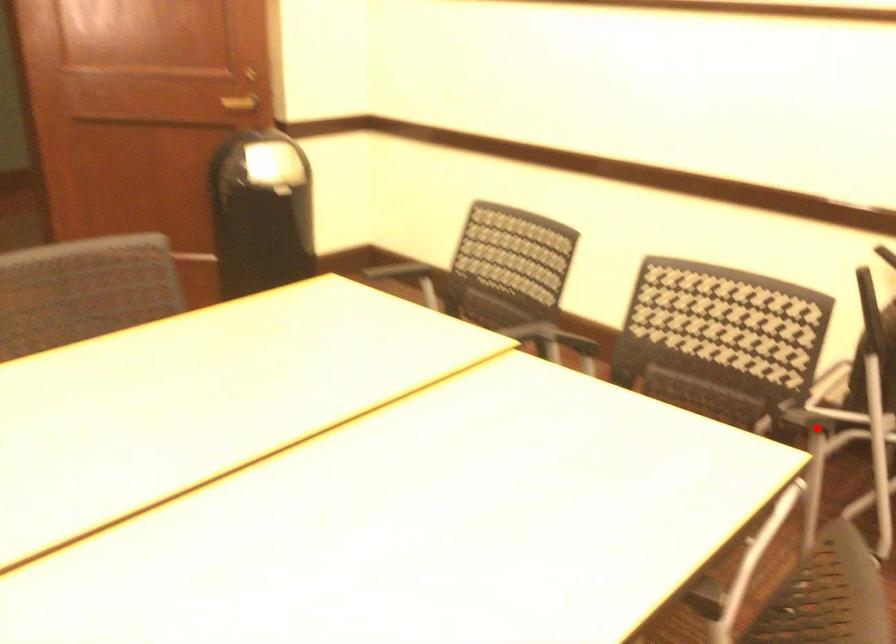
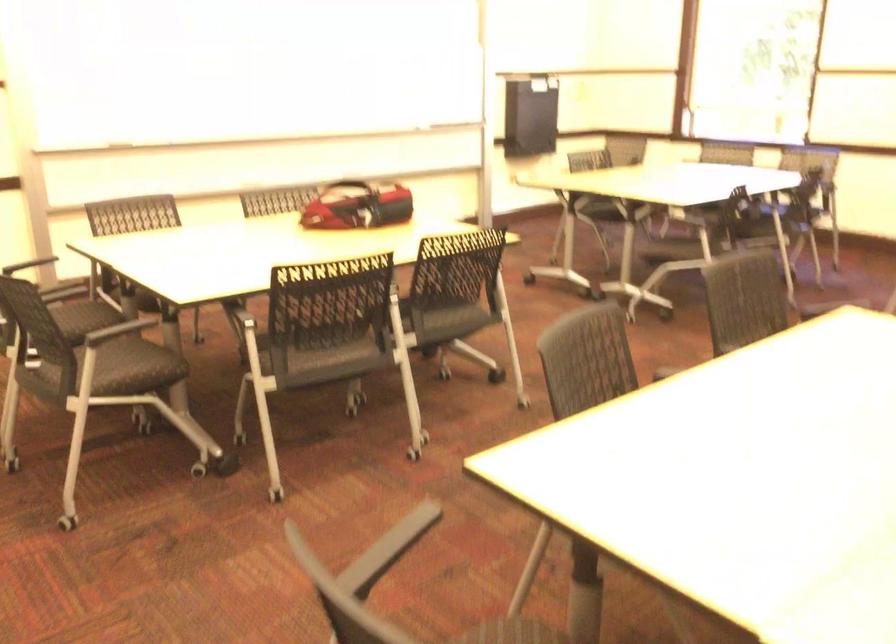
Question: I am providing you with two images of the same scene from different viewpoints. A red point is marked on the first image. Can you still see the location of the red point in image 2?

Choices:
 (A) Yes
 (B) No

Answer: (A)